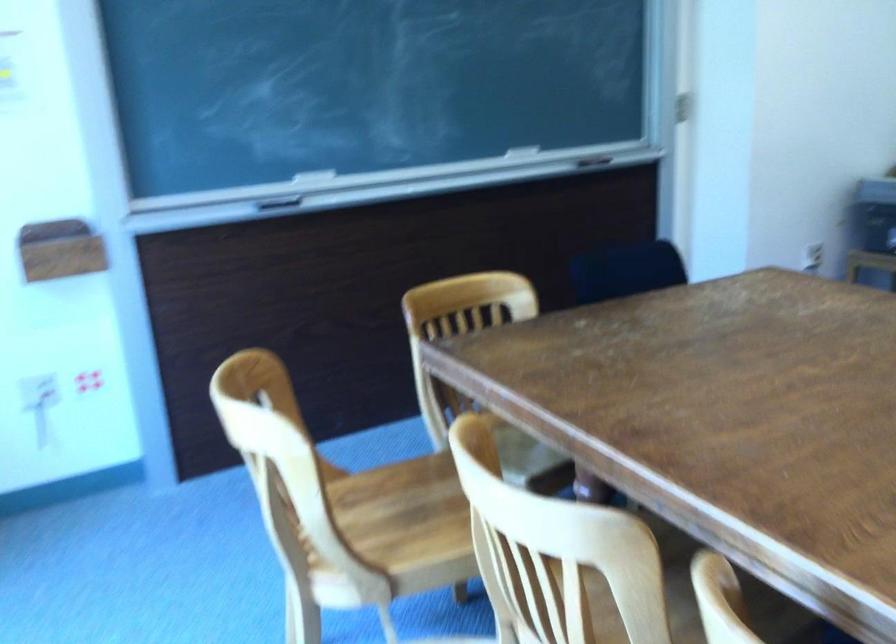
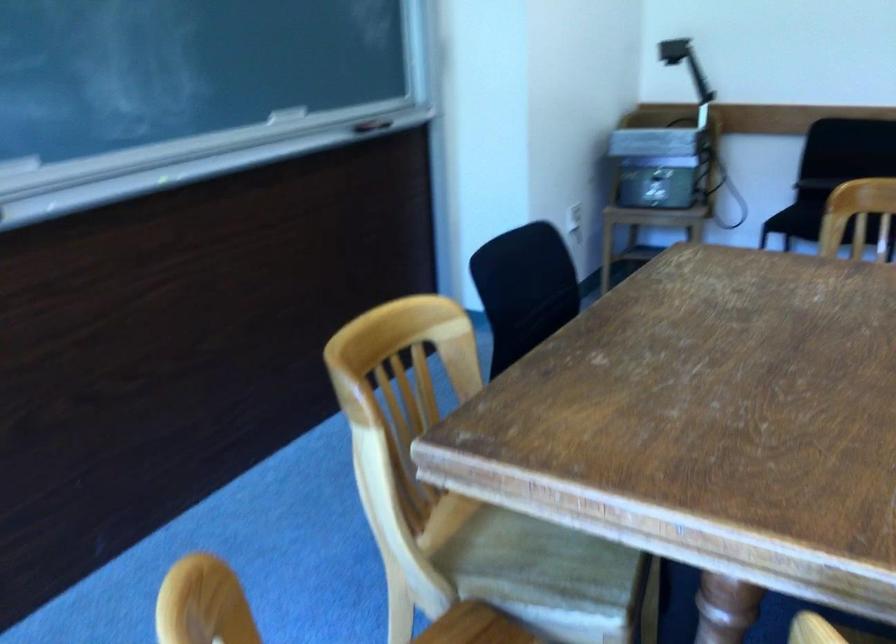
Where in the second image is the point corresponding to (515,446) from the first image?

(528, 556)